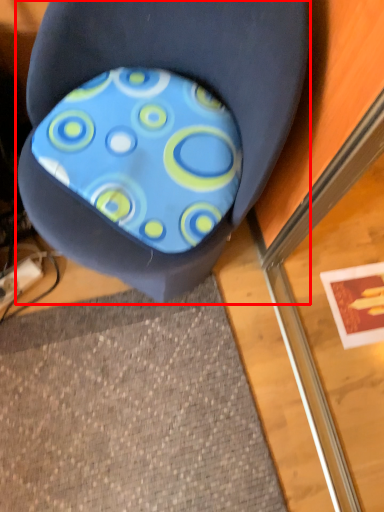
Question: From the image's perspective, what is the correct spatial relationship of chair (annotated by the red box) in relation to design?

Choices:
 (A) above
 (B) below

Answer: (B)